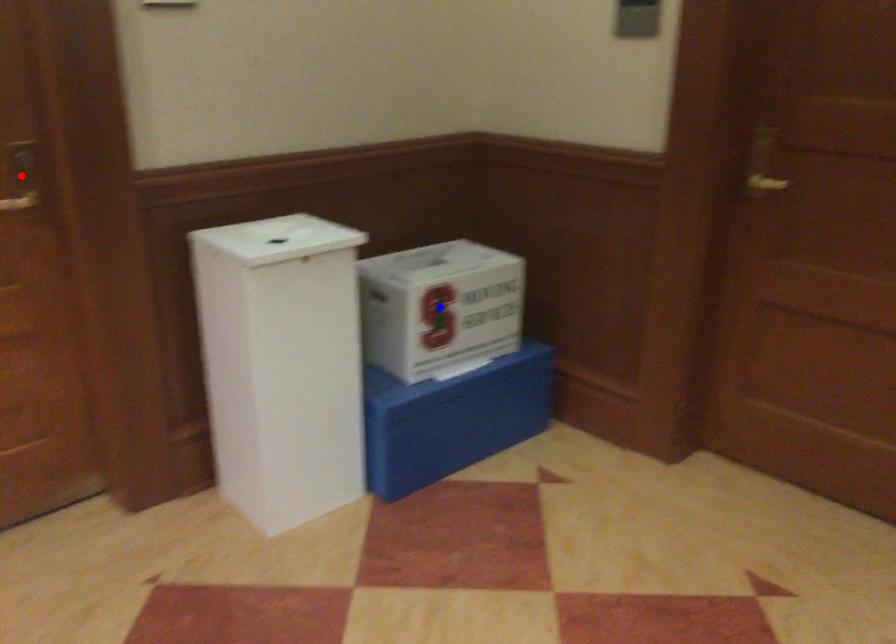
Question: In the image, two points are highlighted. Which point is nearer to the camera? Reply with the corresponding letter.

Choices:
 (A) blue point
 (B) red point

Answer: (B)